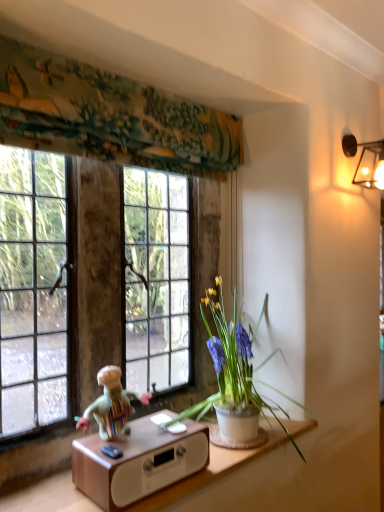
You are a GUI agent. You are given a task and a screenshot of the screen. Output one action in this format:
    pyautogui.click(x=<x>, y=<y>)
    Task: Click on the free space above wooden table at lower center (from a real-world perspective)
    The image size is (384, 512).
    Given the screenshot: What is the action you would take?
    pyautogui.click(x=155, y=432)